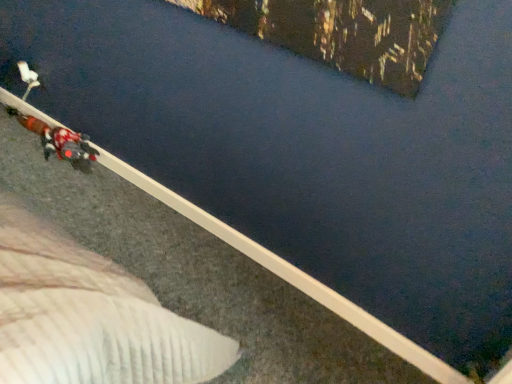
This screenshot has height=384, width=512. I want to click on free space below velvet-like red coat at lower left (from a real-world perspective), so click(71, 158).